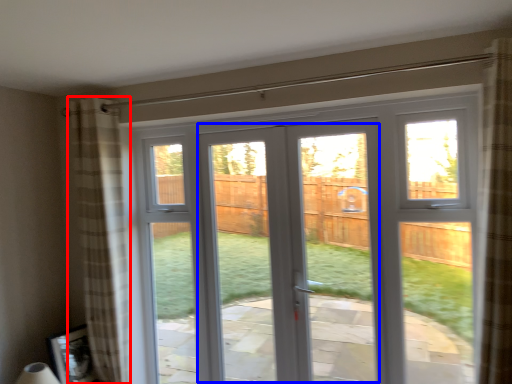
Question: Which point is further to the camera, curtain (highlighted by a red box) or screen door (highlighted by a blue box)?

Choices:
 (A) curtain
 (B) screen door

Answer: (A)